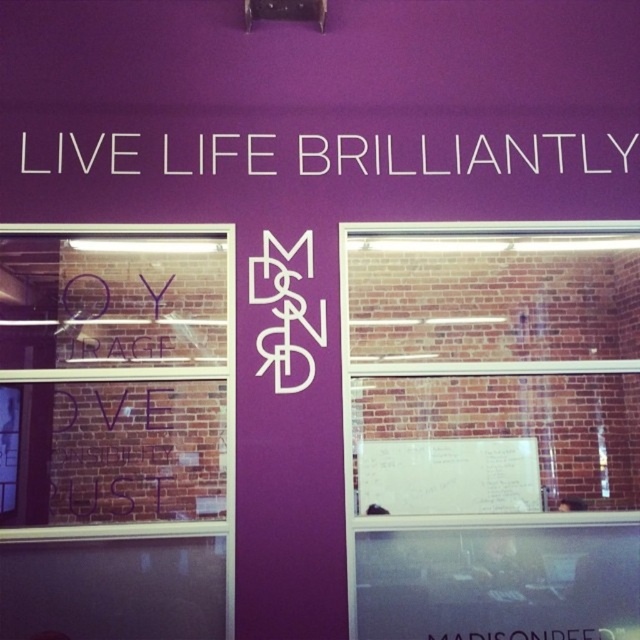
Between brick wall at center and transparent glass window at left, which one is positioned lower?

transparent glass window at left is lower down.

Between point (396, 500) and point (164, 604), which one is positioned behind?

The point (396, 500) is behind.

Locate an element on the screen. brick wall at center is located at coordinates (492, 429).

Does brick wall at center appear on the left side of white text at upper center?

In fact, brick wall at center is to the right of white text at upper center.

Looking at this image, who is lower down, brick wall at center or white text at upper center?

Positioned lower is brick wall at center.

What do you see at coordinates (492, 429) in the screenshot? I see `brick wall at center` at bounding box center [492, 429].

Where is `brick wall at center`? brick wall at center is located at coordinates (492, 429).

Between transparent glass window at left and white text at upper center, which one has less height?

white text at upper center

Can you confirm if transparent glass window at left is positioned below white text at upper center?

Indeed, transparent glass window at left is positioned under white text at upper center.

Who is more distant from viewer, (10, 316) or (193, 161)?

The point (193, 161) is behind.

The width and height of the screenshot is (640, 640). Identify the location of transparent glass window at left. (116, 432).